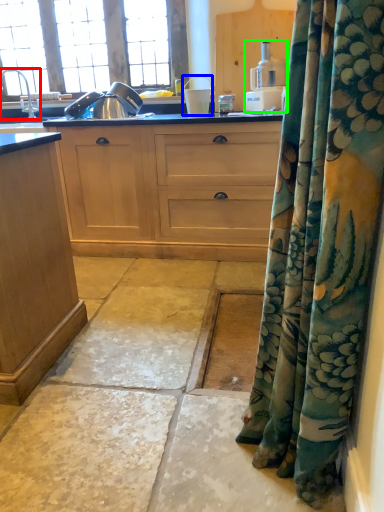
Question: Based on their relative distances, which object is farther from faucet (highlighted by a red box)? Choose from appliance (highlighted by a blue box) and kitchen appliance (highlighted by a green box).

Choices:
 (A) appliance
 (B) kitchen appliance

Answer: (B)